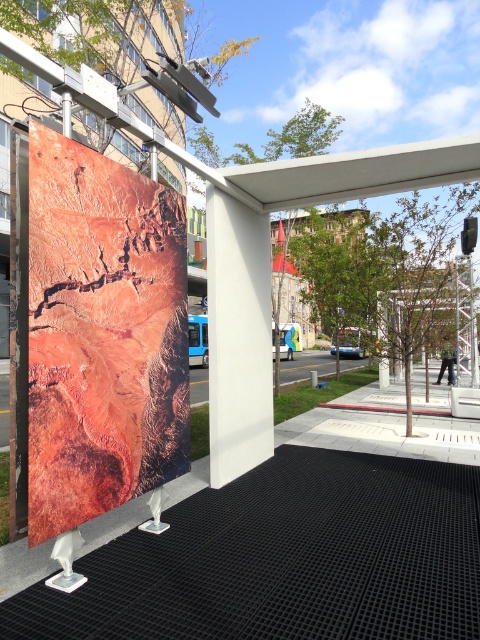
Can you confirm if rustic canvas poster at center is positioned to the right of white matte pillar at center?

Incorrect, rustic canvas poster at center is not on the right side of white matte pillar at center.

Which is behind, point (76, 253) or point (210, 218)?

The point (210, 218) is more distant.

Locate an element on the screen. The height and width of the screenshot is (640, 480). rustic canvas poster at center is located at coordinates (101, 333).